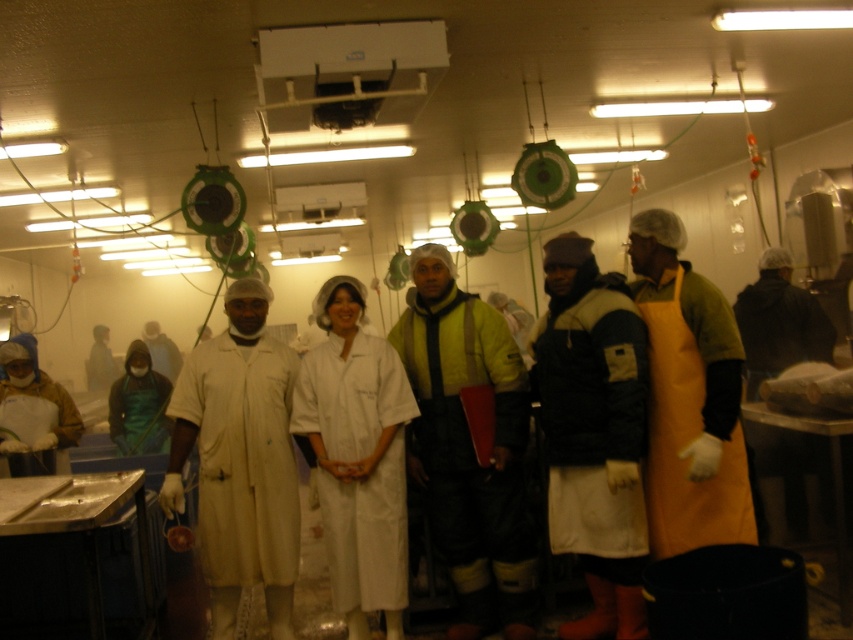
Does white fabric apron at center appear on the right side of orange leather apron at center?

In fact, white fabric apron at center is to the left of orange leather apron at center.

Is white fabric apron at center below orange leather apron at center?

Correct, white fabric apron at center is located below orange leather apron at center.

Who is more forward, (595, 323) or (735, 449)?

Point (735, 449) is in front.

This screenshot has height=640, width=853. Find the location of `white fabric apron at center`. white fabric apron at center is located at coordinates (593, 435).

Can you confirm if white fabric apron at center is shorter than matte white lab coat at center?

Incorrect, white fabric apron at center's height does not fall short of matte white lab coat at center's.

Does white fabric apron at center have a greater width compared to matte white lab coat at center?

Incorrect, white fabric apron at center's width does not surpass matte white lab coat at center's.

Which is behind, point (630, 304) or point (245, 282)?

The point (245, 282) is behind.

In order to click on white fabric apron at center in this screenshot , I will do click(593, 435).

Who is more forward, (x=596, y=486) or (x=381, y=472)?

Point (x=596, y=486) is more forward.

Who is lower down, white fabric apron at center or white matte/soft robe at center?

white matte/soft robe at center is lower down.

Is point (589, 292) less distant than point (328, 554)?

Yes.

This screenshot has width=853, height=640. I want to click on white fabric apron at center, so click(593, 435).